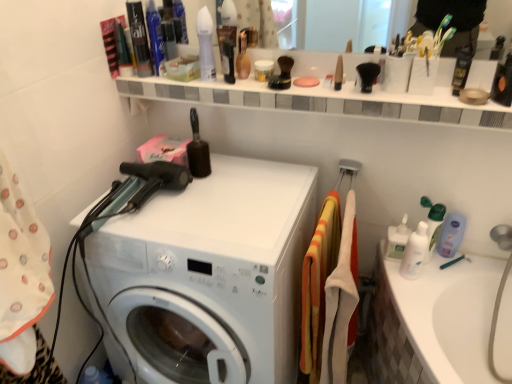
You are a GUI agent. You are given a task and a screenshot of the screen. Output one action in this format:
    pyautogui.click(x=<x>, y=<y>)
    Task: Click on the vacant region above white plastic washing machine at center (from a real-world perspective)
    
    Given the screenshot: What is the action you would take?
    click(227, 204)